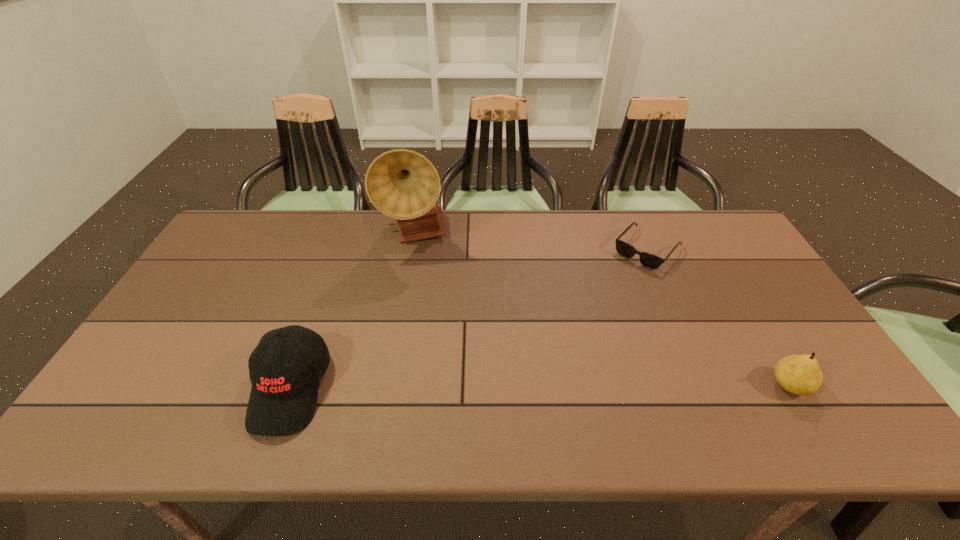
The width and height of the screenshot is (960, 540). I want to click on free spot at the near edge of the desktop, so [x=770, y=381].

Find the location of a particular element. Image resolution: width=960 pixels, height=540 pixels. free space at the left edge is located at coordinates (231, 274).

Find the location of a particular element. free space at the far left corner is located at coordinates (267, 225).

Where is `vacant space at the far right corner`? vacant space at the far right corner is located at coordinates (698, 249).

In order to click on empty space that is in between the pear and the sunglasses in this screenshot , I will do `click(718, 318)`.

Find the location of `unoccupied position between the leftmost object and the third object from right to left`. unoccupied position between the leftmost object and the third object from right to left is located at coordinates (353, 312).

You are a GUI agent. You are given a task and a screenshot of the screen. Output one action in this format:
    pyautogui.click(x=<x>, y=<y>)
    Task: Click on the free point between the second object from left to right and the rightmost object
    The image size is (960, 540).
    Given the screenshot: What is the action you would take?
    pyautogui.click(x=603, y=310)

Locate an element on the screen. free space between the shortest object and the pear is located at coordinates (718, 318).

This screenshot has width=960, height=540. I want to click on empty space between the third object from right to left and the baseball cap, so click(x=353, y=312).

Locate an element on the screen. free space between the phonograph record and the leftmost object is located at coordinates (353, 312).